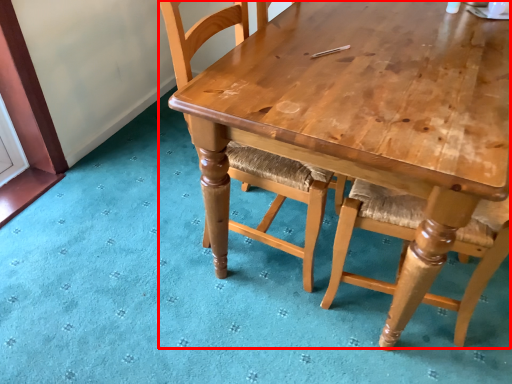
Question: From the image's perspective, where is table (annotated by the red box) located in relation to chair in the image?

Choices:
 (A) below
 (B) above

Answer: (A)